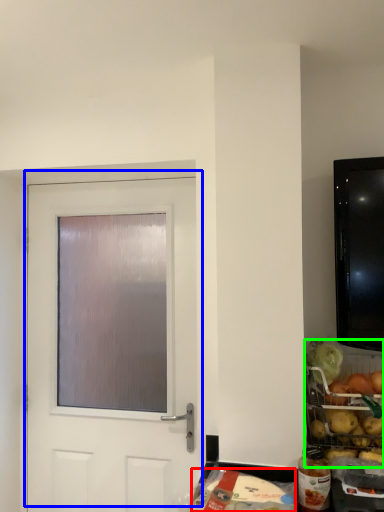
Question: Which object is positioned farthest from food (highlighted by a red box)? Select from door (highlighted by a blue box) and food (highlighted by a green box).

Choices:
 (A) door
 (B) food

Answer: (A)